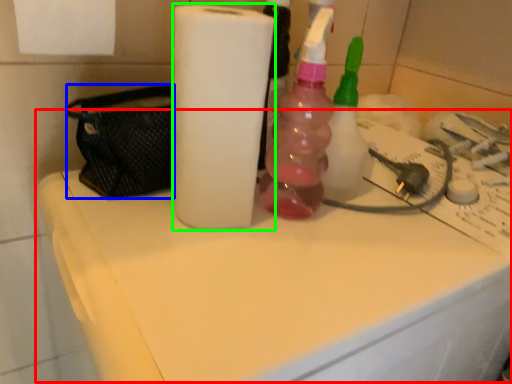
Question: Which object is positioned farthest from counter top (highlighted by a red box)? Select from pouch (highlighted by a blue box) and paper towel (highlighted by a green box).

Choices:
 (A) pouch
 (B) paper towel

Answer: (A)